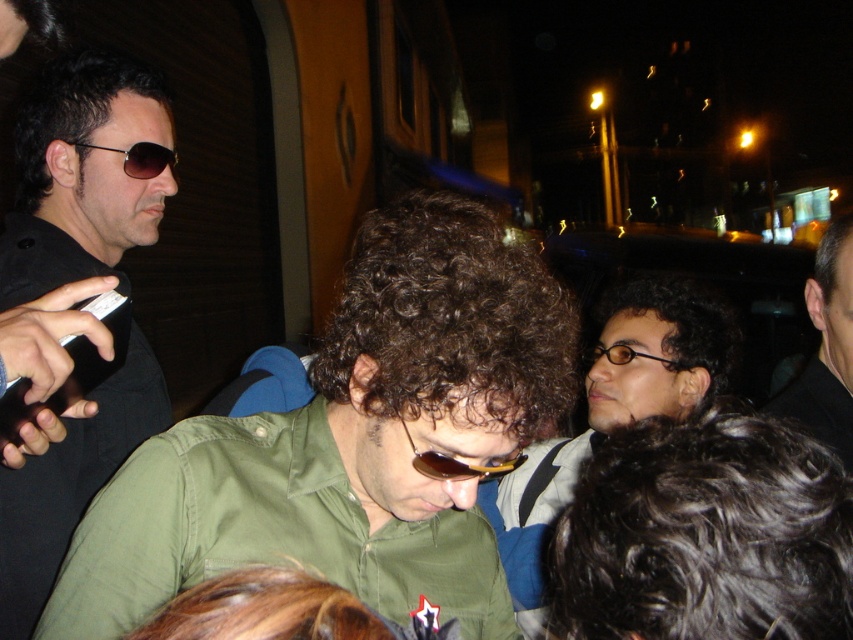
Is point (670, 412) closer to camera compared to point (448, 464)?

No, it is not.

Who is positioned more to the left, matte black hair at center or sunglasses at center?

sunglasses at center is more to the left.

Does point (700, 305) come behind point (489, 476)?

Yes.

The width and height of the screenshot is (853, 640). I want to click on matte black hair at center, so click(612, 412).

Measure the distance between matte black sunglasses at upper left and black plastic glasses at center.

They are 35.55 inches apart.

Does matte black sunglasses at upper left appear over black plastic glasses at center?

Correct, matte black sunglasses at upper left is located above black plastic glasses at center.

Between point (125, 173) and point (669, 369), which one is positioned in front?

Point (669, 369) is more forward.

Locate an element on the screen. matte black sunglasses at upper left is located at coordinates (141, 157).

From the picture: Can you confirm if matte black hair at center is positioned above black plastic glasses at center?

No.

Measure the distance between point (x=621, y=330) and camera.

Point (x=621, y=330) and camera are 5.35 feet apart.

Which is in front, point (705, 353) or point (666, 362)?

Point (666, 362) is more forward.

The height and width of the screenshot is (640, 853). In order to click on matte black hair at center in this screenshot , I will do `click(612, 412)`.